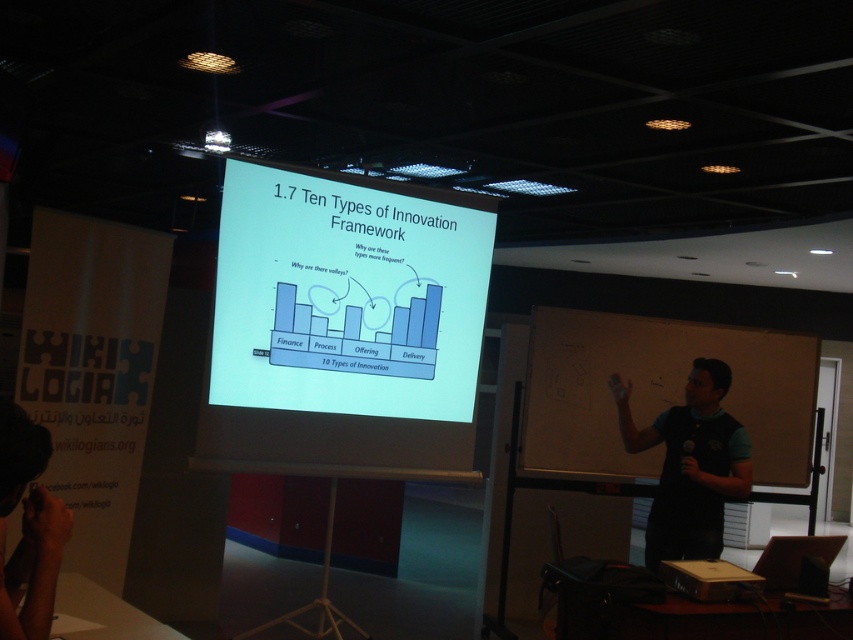
You are an attendee at the presentation and want to take a photo of the projection screen. You have a black fabric camera at lower left and a black fabric shirt at right. Which object is closer to you so you can reach it first?

The black fabric shirt at right is closer to you, so you can reach it first before the black fabric camera at lower left.

You are standing in front of the presentation screen and notice two points marked on the whiteboard. Which point, point (357, 380) or point (788, 483), is nearer to you?

Point (357, 380) is closer to the camera than point (788, 483), so it is nearer to you.

Looking at this image, you are standing in front of the projection screen and want to move to the black fabric shirt at right. In which direction should you move relative to the screen?

You should move to the right relative to the screen to reach the black fabric shirt at right since it is located at point 0.727 on the x axis, which is to the right side of the screen.